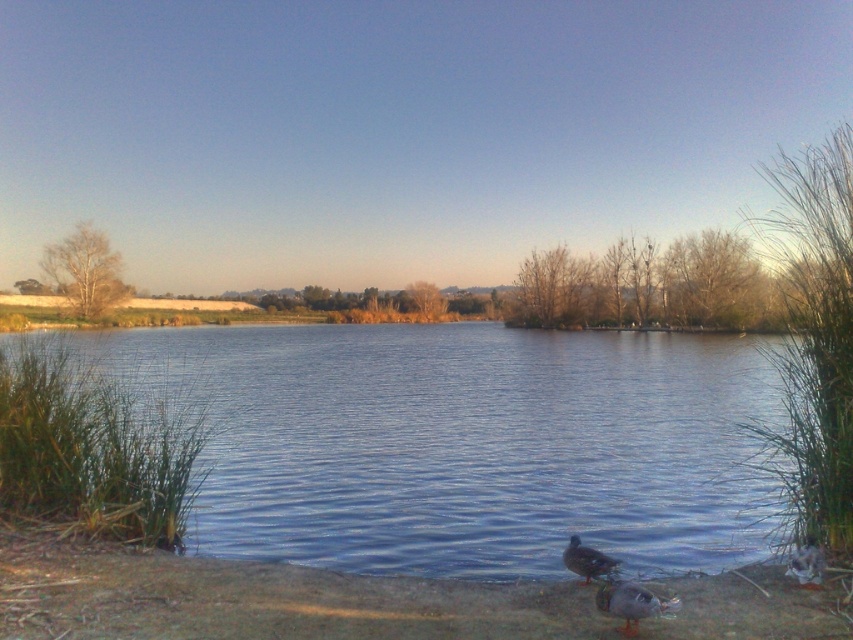
You are standing at the edge of the lake and want to place a small wooden bench. The coordinates for the brown dirt at lower center are given. Where should you place the bench to ensure it stays on the solid ground?

The brown dirt at lower center is located at point (260, 598), so placing the bench there would ensure it stays on solid ground.

You are standing at the point marked as point [463,442] in the image. What is the color of the surface you are currently standing on?

The point [463,442] is on blue water at center, so the surface is blue.